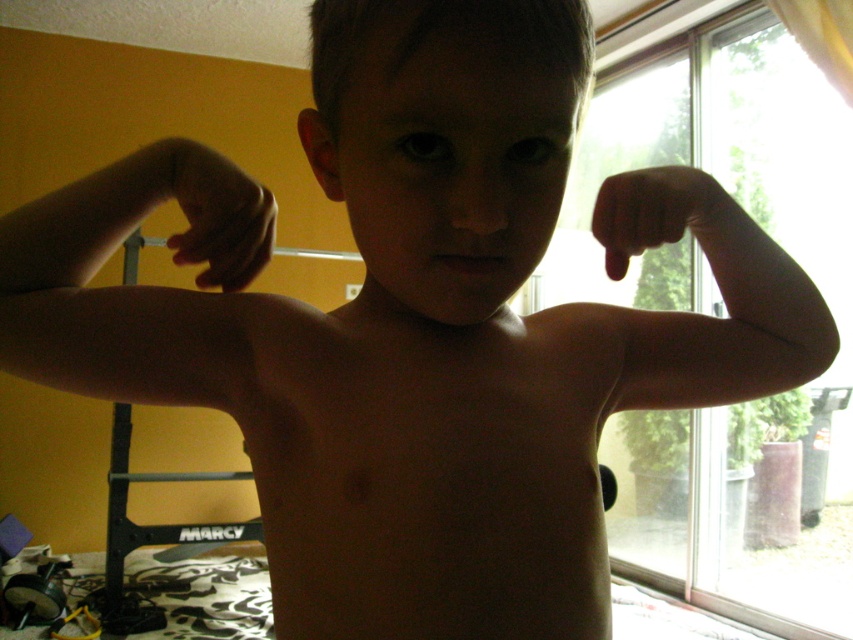
Question: Is skinny flesh at center closer to camera compared to matte skin hand at upper center?

Choices:
 (A) yes
 (B) no

Answer: (A)

Question: Which point is closer to the camera?

Choices:
 (A) transparent glass screen door at right
 (B) matte skin hand at upper center
 (C) skinny flesh at center
 (D) black matte hand at right

Answer: (C)

Question: Which point is closer to the camera?

Choices:
 (A) (788, 259)
 (B) (374, 481)
 (C) (647, 195)
 (D) (177, 182)

Answer: (B)

Question: In this image, where is transparent glass screen door at right located relative to black matte hand at right?

Choices:
 (A) left
 (B) right

Answer: (B)

Question: Which object is farther from the camera taking this photo?

Choices:
 (A) black matte hand at right
 (B) matte skin hand at upper center
 (C) matte skin at left

Answer: (A)

Question: Is matte skin hand at upper center wider than black matte hand at right?

Choices:
 (A) yes
 (B) no

Answer: (B)